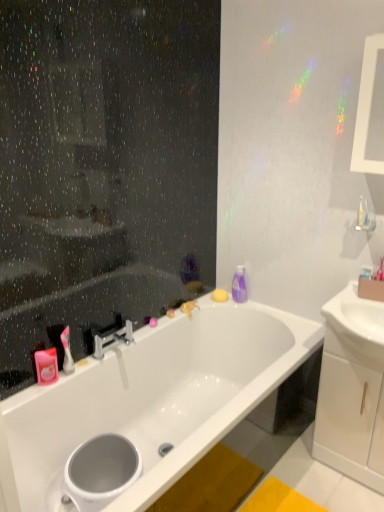
Question: Is pink matte soap at upper left, which is the 1th toiletry in front-to-back order, to the left or to the right of white glossy sink at right in the image?

Choices:
 (A) right
 (B) left

Answer: (B)

Question: Is pink matte soap at upper left, placed as the 2th toiletry when sorted from top to bottom, spatially inside white glossy sink at right, or outside of it?

Choices:
 (A) outside
 (B) inside

Answer: (A)

Question: Estimate the real-world distances between objects in this image. Which object is farther from the white glossy sink at right?

Choices:
 (A) white glossy toilet bowl at lower left
 (B) white glossy bathtub at center
 (C) white glossy cabinet at right
 (D) pink matte soap at upper left, placed as the 2th toiletry when sorted from top to bottom
 (E) silver metallic faucet at center

Answer: (D)

Question: Which is farther from the purple glossy bottle at upper right, the 1th toiletry from the back?

Choices:
 (A) silver metallic faucet at center
 (B) white glossy toilet bowl at lower left
 (C) pink matte soap at upper left, positioned as the first toiletry in left-to-right order
 (D) white glossy bathtub at center
 (E) white glossy cabinet at right

Answer: (B)